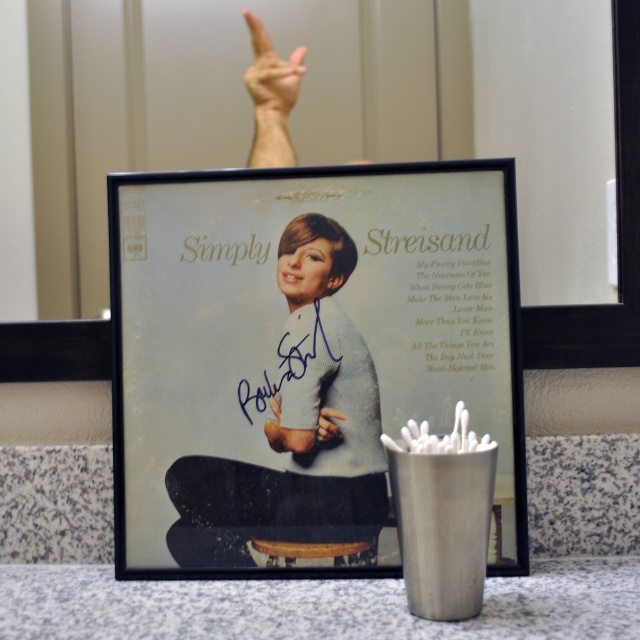
Question: Which of these objects is positioned farthest from the matte black hand at upper center?

Choices:
 (A) skinny white hand at upper center
 (B) matte gray sweater at center
 (C) matte black picture frame at center

Answer: (A)

Question: Which point is farther to the camera?

Choices:
 (A) matte black hand at upper center
 (B) matte gray sweater at center
 (C) skinny white hand at upper center

Answer: (C)

Question: Considering the relative positions of skinny white hand at upper center and matte black hand at upper center in the image provided, where is skinny white hand at upper center located with respect to matte black hand at upper center?

Choices:
 (A) below
 (B) above

Answer: (B)

Question: Which of the following is the closest to the observer?

Choices:
 (A) (282, 77)
 (B) (266, 429)
 (C) (253, 476)

Answer: (C)

Question: Is the position of matte gray sweater at center less distant than that of skinny white hand at upper center?

Choices:
 (A) yes
 (B) no

Answer: (A)

Question: Can you confirm if matte gray sweater at center is smaller than matte black hand at upper center?

Choices:
 (A) no
 (B) yes

Answer: (A)